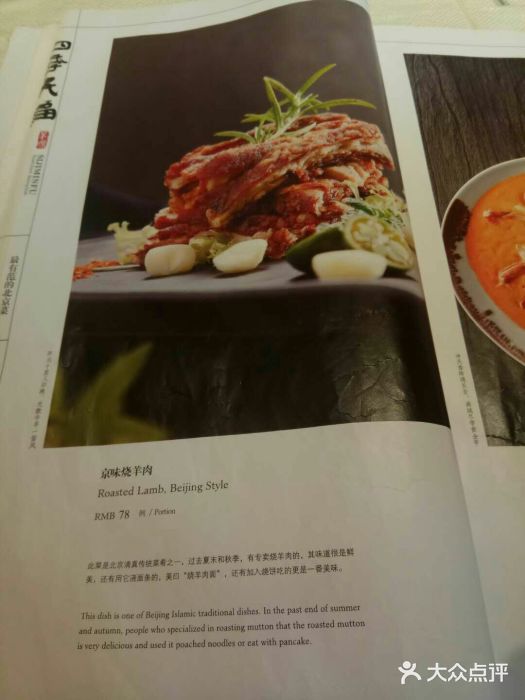
Where is `wooden table in picture`? The height and width of the screenshot is (700, 525). wooden table in picture is located at coordinates (477, 94).